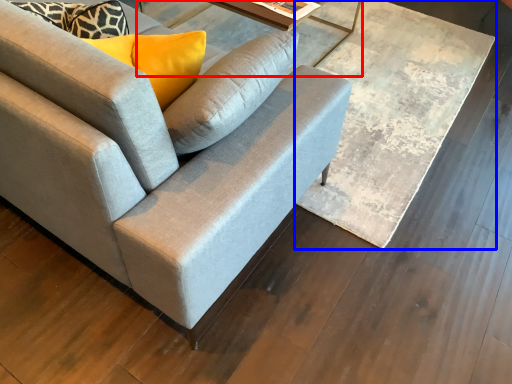
Question: Which of the following is the farthest to the observer, round table (highlighted by a red box) or table (highlighted by a blue box)?

Choices:
 (A) round table
 (B) table

Answer: (A)